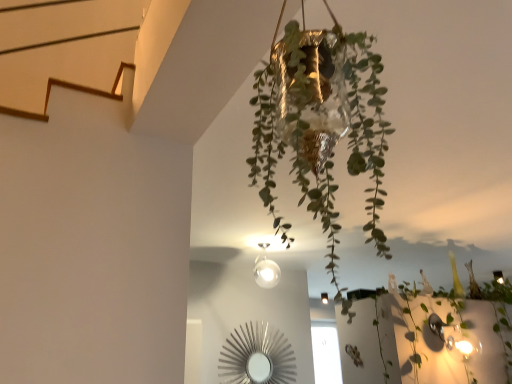
Locate an element on the screen. matte white glass light fixture at center is located at coordinates (324, 298).

Where is `matte white glass light fixture at center`? matte white glass light fixture at center is located at coordinates (324, 298).

From the image's perspective, does green leafy plant at center appear higher than matte white glass light fixture at center?

Correct, green leafy plant at center appears higher than matte white glass light fixture at center in the image.

Which is closer, (356, 366) or (325, 295)?

Point (356, 366).

Is green leafy plant at center taller or shorter than matte white glass light fixture at center?

green leafy plant at center is taller than matte white glass light fixture at center.

Is green leafy plant at center behind matte white glass light fixture at center?

No, green leafy plant at center is closer to the viewer.

In terms of height, does green leafy plant at center look taller or shorter compared to gold foil pot at center?

Clearly, green leafy plant at center is shorter compared to gold foil pot at center.

Does green leafy plant at center come behind gold foil pot at center?

Yes, it is behind gold foil pot at center.

Does green leafy plant at center touch gold foil pot at center?

green leafy plant at center is not next to gold foil pot at center, and they're not touching.

Is point (339, 318) positioned before point (314, 206)?

No, it is not.

Can you confirm if gold foil pot at center is shorter than matte white glass light fixture at center?

No, gold foil pot at center is not shorter than matte white glass light fixture at center.

Is gold foil pot at center turned away from matte white glass light fixture at center?

No, gold foil pot at center is not facing away from matte white glass light fixture at center.

From the image's perspective, between gold foil pot at center and matte white glass light fixture at center, who is located below?

matte white glass light fixture at center is shown below in the image.

Does gold foil pot at center lie behind matte white glass light fixture at center?

No, it is not.

Is matte white glass light fixture at center to the right of green leafy plant at center from the viewer's perspective?

In fact, matte white glass light fixture at center is to the left of green leafy plant at center.

Is matte white glass light fixture at center oriented towards green leafy plant at center?

Yes, matte white glass light fixture at center faces towards green leafy plant at center.

Is green leafy plant at center inside matte white glass light fixture at center?

That's incorrect, green leafy plant at center is not inside matte white glass light fixture at center.

Can you confirm if matte white glass light fixture at center is smaller than green leafy plant at center?

Yes, matte white glass light fixture at center is smaller than green leafy plant at center.

From the image's perspective, is matte white glass light fixture at center positioned above or below gold foil pot at center?

matte white glass light fixture at center is situated lower than gold foil pot at center in the image.

Considering the positions of objects matte white glass light fixture at center and gold foil pot at center in the image provided, who is more to the left, matte white glass light fixture at center or gold foil pot at center?

From the viewer's perspective, gold foil pot at center appears more on the left side.

Looking at this image, from a real-world perspective, which object stands above the other?

matte white glass light fixture at center.

Measure the distance between matte white glass light fixture at center and gold foil pot at center.

matte white glass light fixture at center is 3.98 meters from gold foil pot at center.

This screenshot has height=384, width=512. In order to click on plant behind the gold foil pot at center in this screenshot , I will do `click(426, 337)`.

Is gold foil pot at center aimed at green leafy plant at center?

No, gold foil pot at center does not turn towards green leafy plant at center.

Who is taller, gold foil pot at center or green leafy plant at center?

Standing taller between the two is gold foil pot at center.

Is the position of gold foil pot at center more distant than that of green leafy plant at center?

No, gold foil pot at center is in front of green leafy plant at center.

At what (x,y) coordinates should I click in order to perform the action: click on light fixture below the green leafy plant at center (from the image's perspective). Please return your answer as a coordinate pair (x, y). Image resolution: width=512 pixels, height=384 pixels. Looking at the image, I should click on (324, 298).

At what (x,y) coordinates should I click in order to perform the action: click on plant to the right of gold foil pot at center. Please return your answer as a coordinate pair (x, y). This screenshot has height=384, width=512. Looking at the image, I should click on (426, 337).

From the image, which object appears to be farther from gold foil pot at center, green leafy plant at center or matte white glass light fixture at center?

Among the two, matte white glass light fixture at center is located further to gold foil pot at center.

Looking at the image, which one is located closer to matte white glass light fixture at center, green leafy plant at center or gold foil pot at center?

Based on the image, green leafy plant at center appears to be nearer to matte white glass light fixture at center.

Based on their spatial positions, is matte white glass light fixture at center or green leafy plant at center further from gold foil pot at center?

matte white glass light fixture at center is further to gold foil pot at center.

Which object lies nearer to the anchor point matte white glass light fixture at center, gold foil pot at center or green leafy plant at center?

The object closer to matte white glass light fixture at center is green leafy plant at center.

Looking at the image, which one is located further to green leafy plant at center, matte white glass light fixture at center or gold foil pot at center?

Based on the image, gold foil pot at center appears to be further to green leafy plant at center.

Looking at the image, which one is located closer to green leafy plant at center, gold foil pot at center or matte white glass light fixture at center?

matte white glass light fixture at center is positioned closer to the anchor green leafy plant at center.

The height and width of the screenshot is (384, 512). Find the location of `plant located between gold foil pot at center and matte white glass light fixture at center in the depth direction`. plant located between gold foil pot at center and matte white glass light fixture at center in the depth direction is located at coordinates (426, 337).